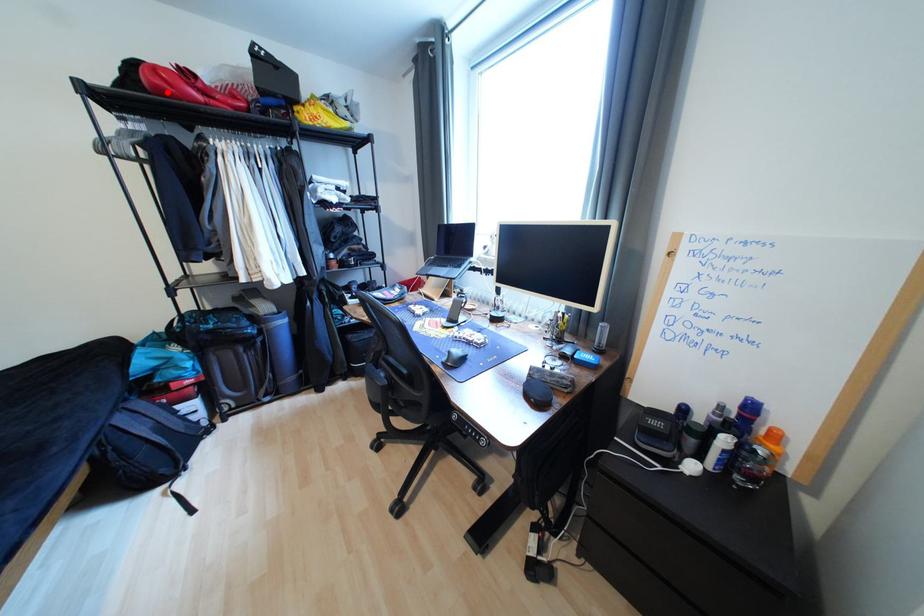
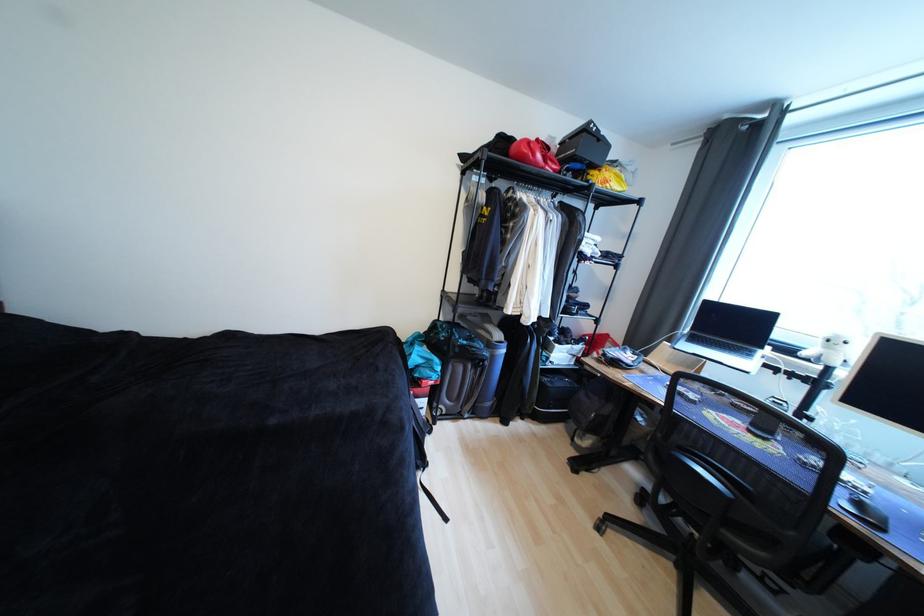
Question: I am providing you with two images of the same scene from different viewpoints. In image1, a red point is highlighted. Considering the same 3D point in image2, which of the following is correct?

Choices:
 (A) It is closer
 (B) It is farther

Answer: (A)